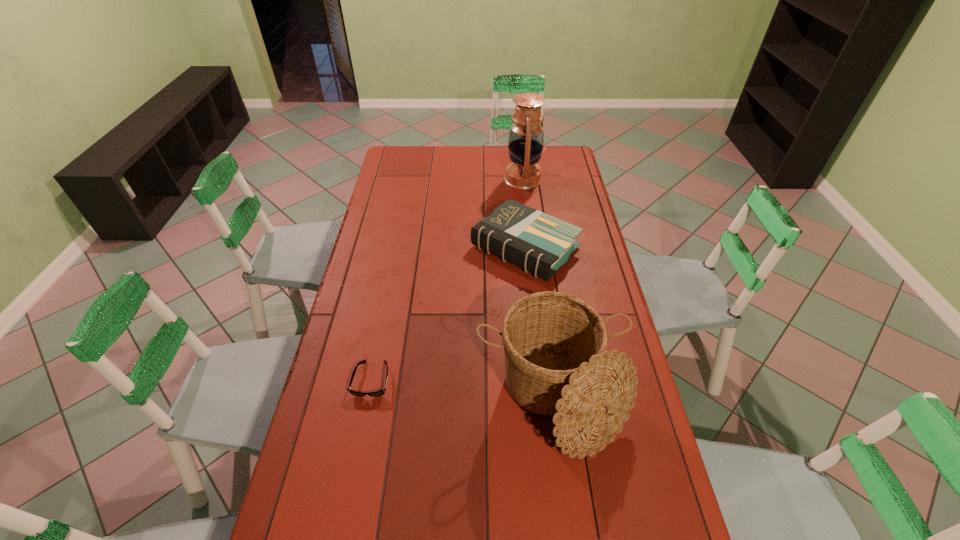
You are a GUI agent. You are given a task and a screenshot of the screen. Output one action in this format:
    pyautogui.click(x=<x>, y=<y>)
    Task: Click on the vacant region that satisfies the following two spatial constraints: 1. on the front-facing side of the shortest object; 2. on the left side of the third shortest object
    The height and width of the screenshot is (540, 960).
    Given the screenshot: What is the action you would take?
    pyautogui.click(x=368, y=400)

Locate an element on the screen. The image size is (960, 540). free space that satisfies the following two spatial constraints: 1. on the front-facing side of the sunglasses; 2. on the left side of the basket is located at coordinates (368, 400).